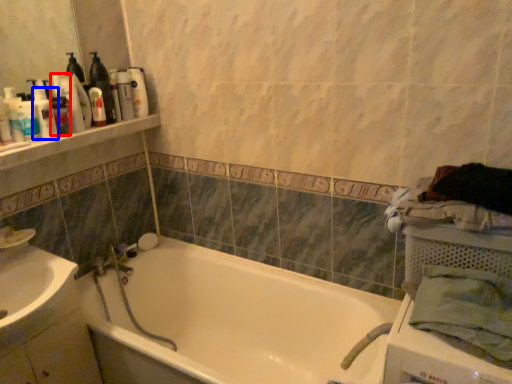
Question: Which object appears closest to the camera in this image, toiletry (highlighted by a red box) or toiletry (highlighted by a blue box)?

Choices:
 (A) toiletry
 (B) toiletry

Answer: (B)